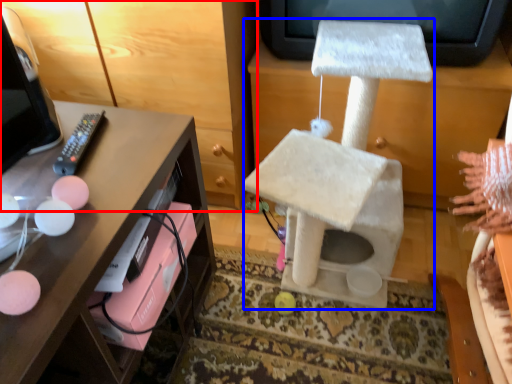
Question: Which object is further to the camera taking this photo, furniture (highlighted by a red box) or swivel chair (highlighted by a blue box)?

Choices:
 (A) furniture
 (B) swivel chair

Answer: (A)